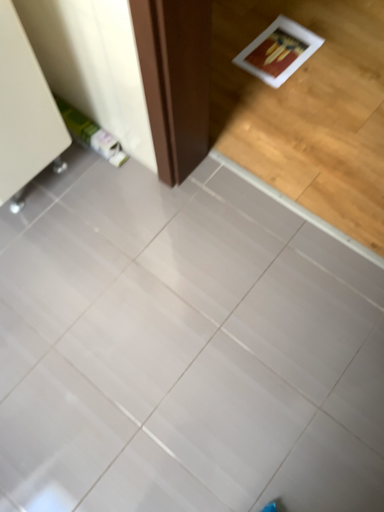
At what (x,y) coordinates should I click in order to perform the action: click on free space above white glossy tile at center (from a real-world perspective). Please return your answer as a coordinate pair (x, y). The height and width of the screenshot is (512, 384). Looking at the image, I should click on (166, 327).